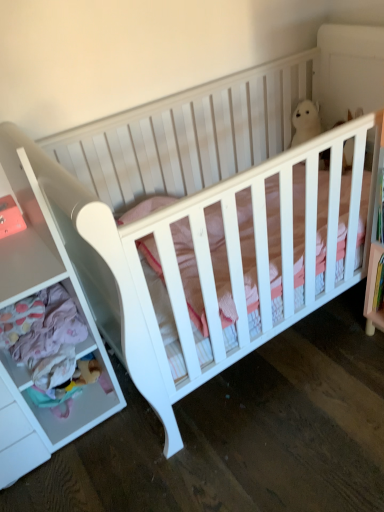
You are a GUI agent. You are given a task and a screenshot of the screen. Output one action in this format:
    pyautogui.click(x=<x>, y=<y>)
    Task: Click on the white matte drawer at left
    
    Given the screenshot: What is the action you would take?
    pyautogui.click(x=76, y=346)

The image size is (384, 512). What do you see at coordinates (305, 122) in the screenshot? I see `white plush bear at upper center` at bounding box center [305, 122].

Find the location of a particular element. This screenshot has width=384, height=512. white matte drawer at left is located at coordinates (76, 346).

At what (x,y) coordinates should I click in order to perform the action: click on toy below the white plush bear at upper center (from a real-world perspective). Please return your answer as a coordinate pair (x, y). This screenshot has height=512, width=384. Looking at the image, I should click on (73, 383).

From a real-world perspective, is soft plush bear at lower left above or below white plush bear at upper center?

Clearly, from a real-world perspective, soft plush bear at lower left is below white plush bear at upper center.

Is soft plush bear at lower left positioned beyond the bounds of white plush bear at upper center?

Yes.

Does soft plush bear at lower left appear on the left side of white plush bear at upper center?

Yes, soft plush bear at lower left is to the left of white plush bear at upper center.

I want to click on dresser below the white plush bear at upper center (from the image's perspective), so click(x=76, y=346).

Who is shorter, white matte drawer at left or white plush bear at upper center?

white plush bear at upper center.

Is point (102, 343) positioned in front of point (314, 109)?

Yes, it is in front of point (314, 109).

Is the position of white matte drawer at left less distant than that of white plush bear at upper center?

Yes.

This screenshot has height=512, width=384. Find the location of `dresser in front of the soft plush bear at lower left`. dresser in front of the soft plush bear at lower left is located at coordinates (76, 346).

Which is closer to the camera, (18, 284) or (78, 368)?

Point (18, 284) appears to be closer to the viewer than point (78, 368).

From a real-world perspective, which object stands above the other?

white matte drawer at left, from a real-world perspective.

Does soft plush bear at lower left have a greater height compared to white matte drawer at left?

No.

Considering the sizes of objects soft plush bear at lower left and white matte drawer at left in the image provided, who is smaller, soft plush bear at lower left or white matte drawer at left?

soft plush bear at lower left is smaller.

From a real-world perspective, which is physically below, soft plush bear at lower left or white matte drawer at left?

soft plush bear at lower left is physically lower.

From the picture: Who is shorter, white plush bear at upper center or soft plush bear at lower left?

Standing shorter between the two is soft plush bear at lower left.

Is white plush bear at upper center at the right side of soft plush bear at lower left?

Yes, white plush bear at upper center is to the right of soft plush bear at lower left.

From the image's perspective, which one is positioned lower, white plush bear at upper center or soft plush bear at lower left?

From the image's view, soft plush bear at lower left is below.

Is white plush bear at upper center wider than white matte drawer at left?

No, white plush bear at upper center is not wider than white matte drawer at left.

From the image's perspective, relative to white matte drawer at left, is white plush bear at upper center above or below?

From the image's perspective, white plush bear at upper center appears above white matte drawer at left.

Is white plush bear at upper center smaller than white matte drawer at left?

Yes, white plush bear at upper center is smaller than white matte drawer at left.

How far apart are white plush bear at upper center and white matte drawer at left?

The distance of white plush bear at upper center from white matte drawer at left is 4.92 feet.

At what (x,y) coordinates should I click in order to perform the action: click on toy to the left of white plush bear at upper center. Please return your answer as a coordinate pair (x, y). The width and height of the screenshot is (384, 512). Looking at the image, I should click on (73, 383).

Find the location of a particular element. dresser that is in front of the white plush bear at upper center is located at coordinates (76, 346).

When comparing their distances from white plush bear at upper center, does white matte drawer at left or soft plush bear at lower left seem closer?

Among the two, white matte drawer at left is located nearer to white plush bear at upper center.

Based on their spatial positions, is soft plush bear at lower left or white matte drawer at left further from white plush bear at upper center?

Among the two, soft plush bear at lower left is located further to white plush bear at upper center.

Looking at the image, which one is located further to white matte drawer at left, white plush bear at upper center or soft plush bear at lower left?

white plush bear at upper center.

Based on the photo, from the image, which object appears to be nearer to soft plush bear at lower left, white matte drawer at left or white plush bear at upper center?

white matte drawer at left is closer to soft plush bear at lower left.

From the image, which object appears to be nearer to soft plush bear at lower left, white plush bear at upper center or white matte drawer at left?

white matte drawer at left lies closer to soft plush bear at lower left than the other object.

Based on their spatial positions, is soft plush bear at lower left or white plush bear at upper center closer to white matte drawer at left?

Among the two, soft plush bear at lower left is located nearer to white matte drawer at left.

You are a GUI agent. You are given a task and a screenshot of the screen. Output one action in this format:
    pyautogui.click(x=<x>, y=<y>)
    Task: Click on the toy located between white matte drawer at left and white plush bear at upper center in the left-right direction
    The image size is (384, 512).
    Given the screenshot: What is the action you would take?
    pyautogui.click(x=73, y=383)